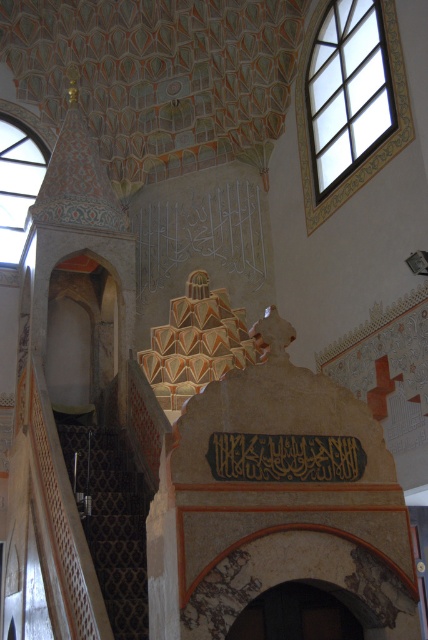
Question: In this image, where is dark brown carpeted stairs at lower left located relative to black calligraphy at center?

Choices:
 (A) right
 (B) left

Answer: (B)

Question: Does dark brown carpeted stairs at lower left have a greater width compared to black calligraphy at center?

Choices:
 (A) no
 (B) yes

Answer: (B)

Question: Which object appears farthest from the camera in this image?

Choices:
 (A) black calligraphy at center
 (B) dark brown carpeted stairs at lower left

Answer: (B)

Question: Is dark brown carpeted stairs at lower left to the right of black calligraphy at center from the viewer's perspective?

Choices:
 (A) no
 (B) yes

Answer: (A)